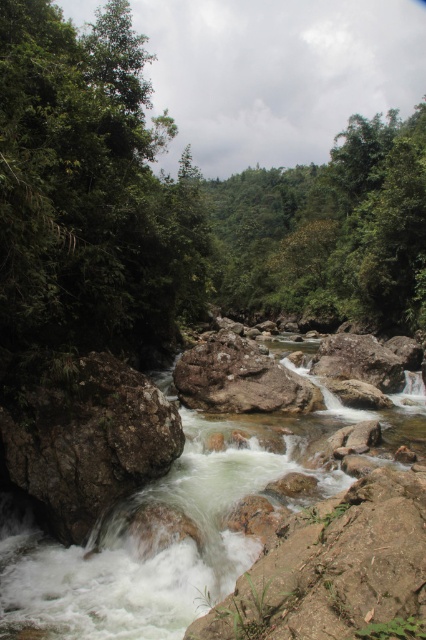
You are standing on the bank of the river and want to cross to the other side. You see the rocky white water at center and the rough textured rock at center. Which one is shorter and can be stepped over easily?

The rocky white water at center is not as tall as the rough textured rock at center, so it is shorter and can be stepped over more easily.

You are a hiker trying to cross the river. You see the rocky white water at center and the rough textured rock at center. Which object is located above the other?

The rough textured rock at center is above the rocky white water at center because the rocky white water at center is positioned under the rough textured rock at center.

You are standing at the edge of the river and see the point marked at coordinates (86, 440). What type of object is located at that point?

The point at coordinates (86, 440) corresponds to a rough textured rock at center.